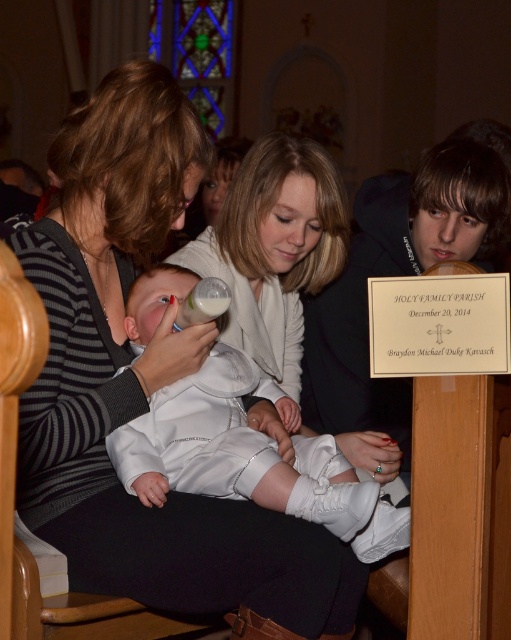
Question: Which point is farther from the camera taking this photo?

Choices:
 (A) (33, 465)
 (B) (197, 288)

Answer: (B)

Question: Can you confirm if striped sweater at center is positioned above white satin baby at center?

Choices:
 (A) yes
 (B) no

Answer: (A)

Question: Considering the real-world distances, which object is farthest from the white satin baby at center?

Choices:
 (A) striped sweater at center
 (B) white plastic bottle at center

Answer: (B)

Question: Among these points, which one is nearest to the camera?

Choices:
 (A) (267, 397)
 (B) (41, 461)
 (C) (177, 330)

Answer: (B)

Question: Considering the relative positions of striped sweater at center and white satin baby at center in the image provided, where is striped sweater at center located with respect to white satin baby at center?

Choices:
 (A) below
 (B) above

Answer: (B)

Question: Is white satin baby at center above white plastic bottle at center?

Choices:
 (A) no
 (B) yes

Answer: (A)